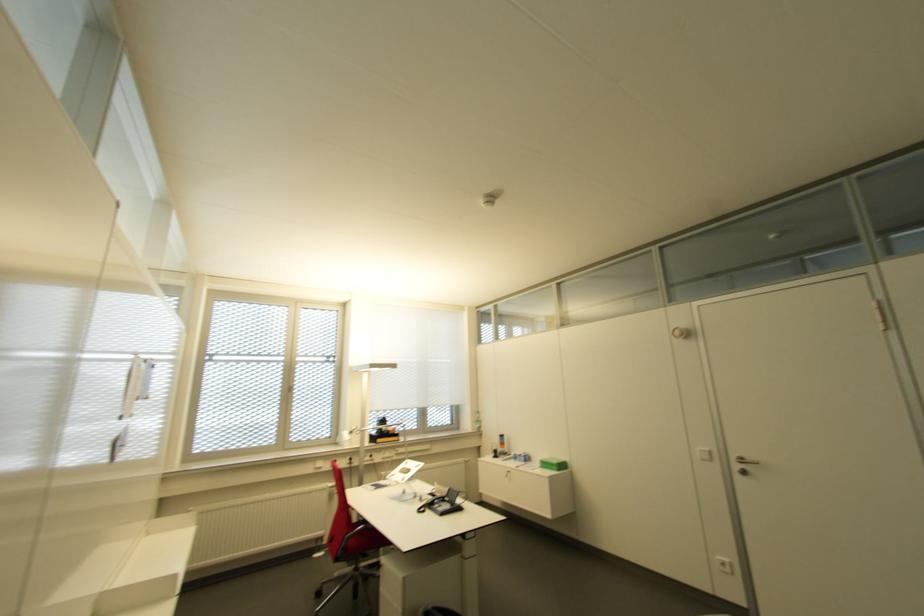
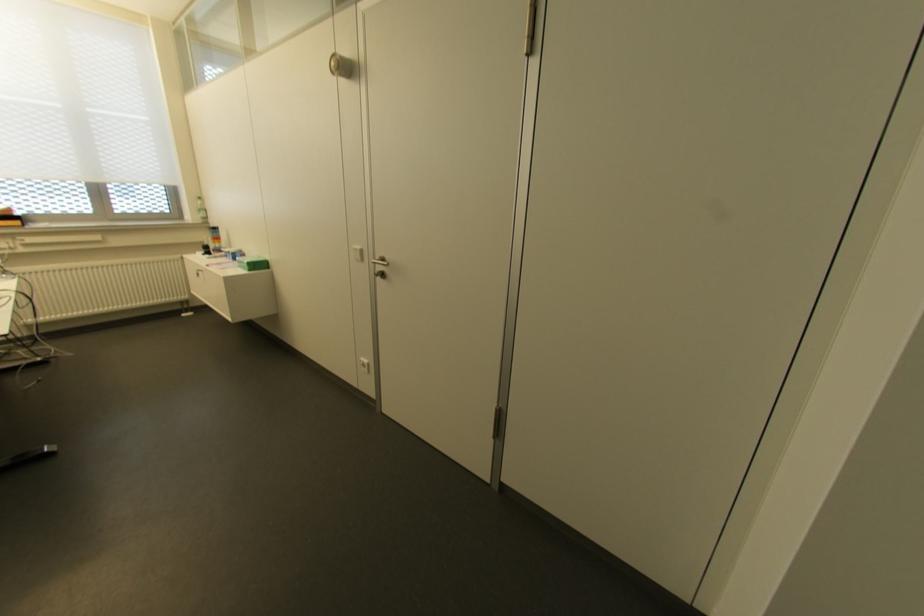
In the second image, find the point that corresponds to (x=706, y=451) in the first image.

(358, 246)